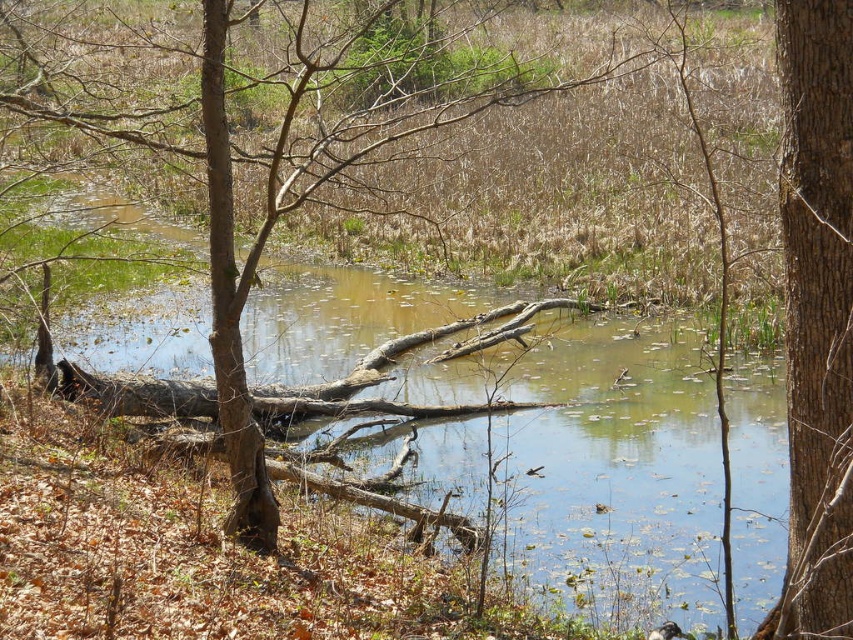
You are standing at the center of the image and want to reach the edge of the pond. Is the brown wood log at center blocking your path directly towards the pond?

The brown wood log at center is located at point (598, 458), which is near the center of the image. Since you are also at the center, the log is directly in your path towards the pond edge, so it would block your way.

You are standing at the center of the image and want to walk towards the brown rough bark tree at right. Which direction should you face to head directly towards it?

The brown rough bark tree at right is located at point (817,312), which is to the right side of the image. Since you are at the center, you should face towards the right direction to head directly towards it.

You are a hiker trying to cross the pond. You see the brown rough bark tree at right and the brown rough bark tree trunk at left. Which tree can provide a wider platform for you to step on?

The brown rough bark tree at right has a larger size compared to the brown rough bark tree trunk at left, so it can provide a wider platform for stepping on.